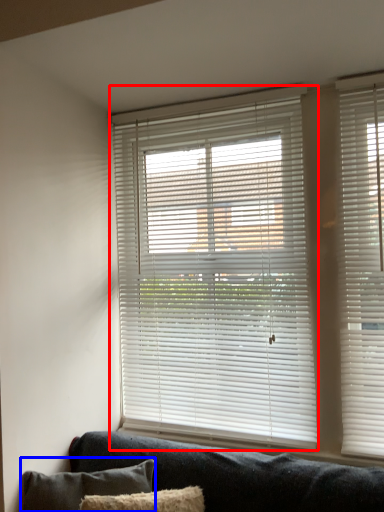
Question: Which of the following is the closest to the observer, window blind (highlighted by a red box) or pillow (highlighted by a blue box)?

Choices:
 (A) window blind
 (B) pillow

Answer: (B)